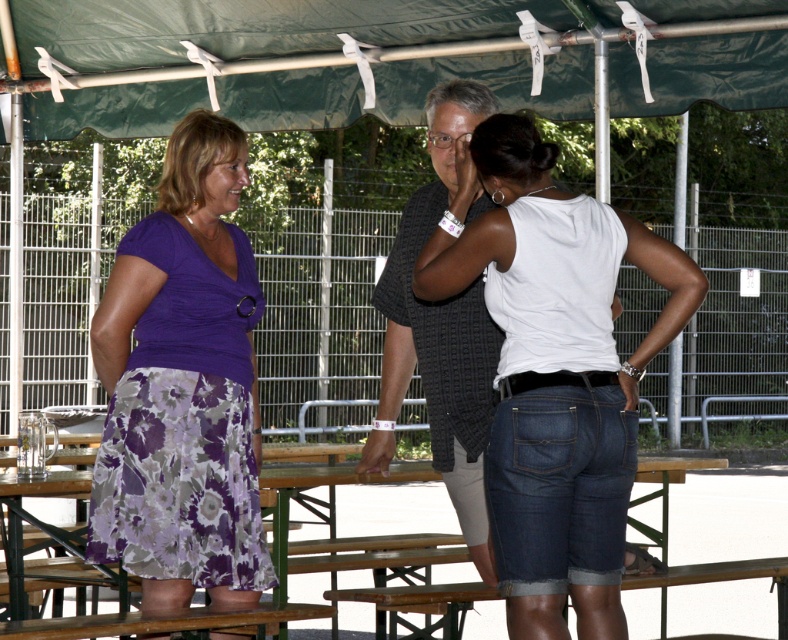
Question: Which is nearer to the purple floral skirt at left?

Choices:
 (A) wooden picnic table at center
 (B) green fabric canopy at upper center

Answer: (B)

Question: Does green fabric canopy at upper center have a greater width compared to purple floral skirt at left?

Choices:
 (A) yes
 (B) no

Answer: (A)

Question: Is green fabric canopy at upper center to the right of wooden picnic table at center from the viewer's perspective?

Choices:
 (A) yes
 (B) no

Answer: (A)

Question: Estimate the real-world distances between objects in this image. Which object is closer to the green fabric canopy at upper center?

Choices:
 (A) wooden picnic table at center
 (B) purple floral skirt at left
 (C) white matte tank top at center

Answer: (A)

Question: From the image, what is the correct spatial relationship of green fabric canopy at upper center in relation to white matte tank top at center?

Choices:
 (A) below
 (B) above

Answer: (B)

Question: Which of the following is the closest to the observer?

Choices:
 (A) purple floral skirt at left
 (B) wooden picnic table at center
 (C) green fabric canopy at upper center
 (D) white matte tank top at center

Answer: (D)